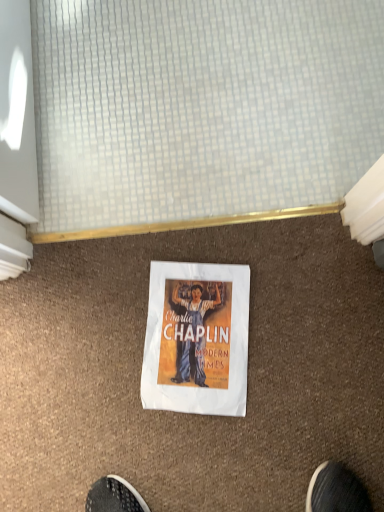
You are a GUI agent. You are given a task and a screenshot of the screen. Output one action in this format:
    pyautogui.click(x=<x>, y=<y>)
    Task: Click on the free space above matte paper poster at center (from a real-world perspective)
    This screenshot has width=384, height=512.
    Given the screenshot: What is the action you would take?
    pyautogui.click(x=195, y=339)